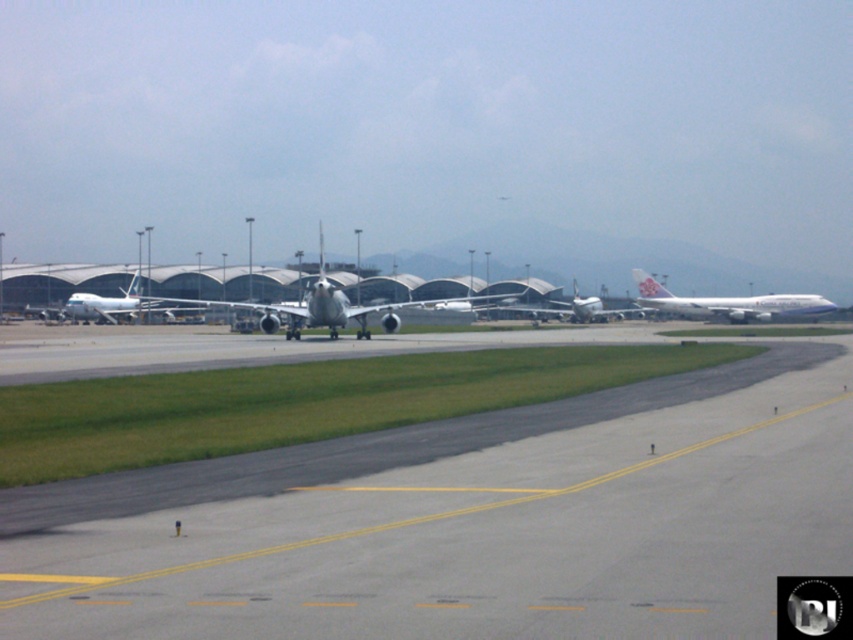
Question: Can you confirm if white glossy airplane at right is smaller than metallic silver airplane at center?

Choices:
 (A) no
 (B) yes

Answer: (A)

Question: Which of the following is the farthest from the observer?

Choices:
 (A) silver metallic airplane at center
 (B) gray asphalt runway at center

Answer: (A)

Question: Which of the following is the farthest from the observer?

Choices:
 (A) (596, 316)
 (B) (236, 625)

Answer: (A)

Question: Which object is farther from the camera taking this photo?

Choices:
 (A) silver metallic airplane at center
 (B) white glossy airplane at right
 (C) white glossy airplane at center
 (D) gray asphalt runway at center

Answer: (C)

Question: Is gray asphalt runway at center below silver metallic airplane at center?

Choices:
 (A) yes
 (B) no

Answer: (A)

Question: Is gray asphalt runway at center smaller than silver metallic airplane at center?

Choices:
 (A) yes
 (B) no

Answer: (A)